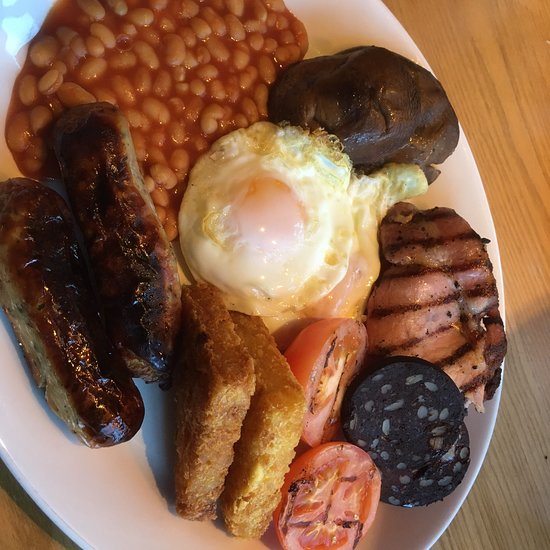
You are a GUI agent. You are given a task and a screenshot of the screen. Output one action in this format:
    pyautogui.click(x=<x>, y=<y>)
    Task: Click on the white ceramic plate
    The image size is (550, 550).
    Given the screenshot: What is the action you would take?
    pyautogui.click(x=89, y=494)